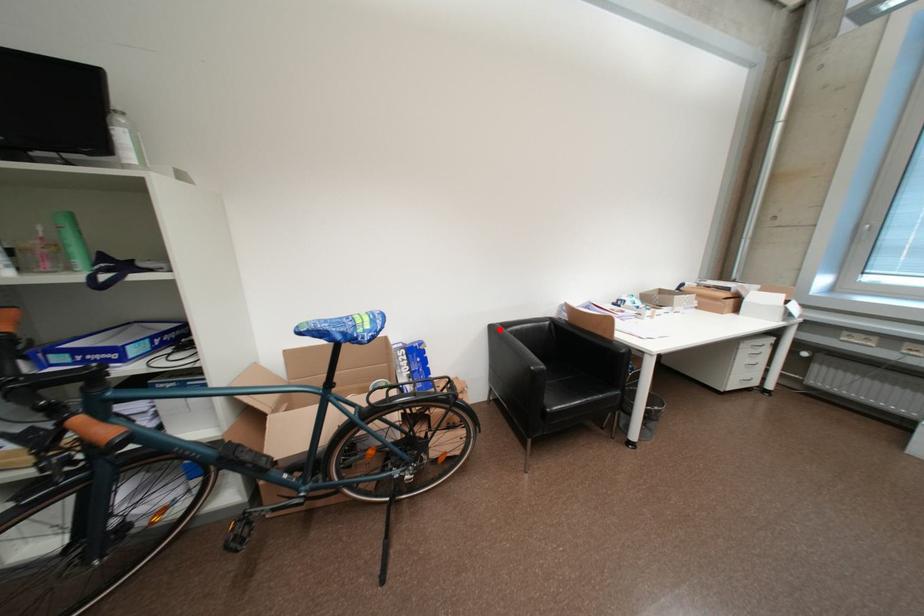
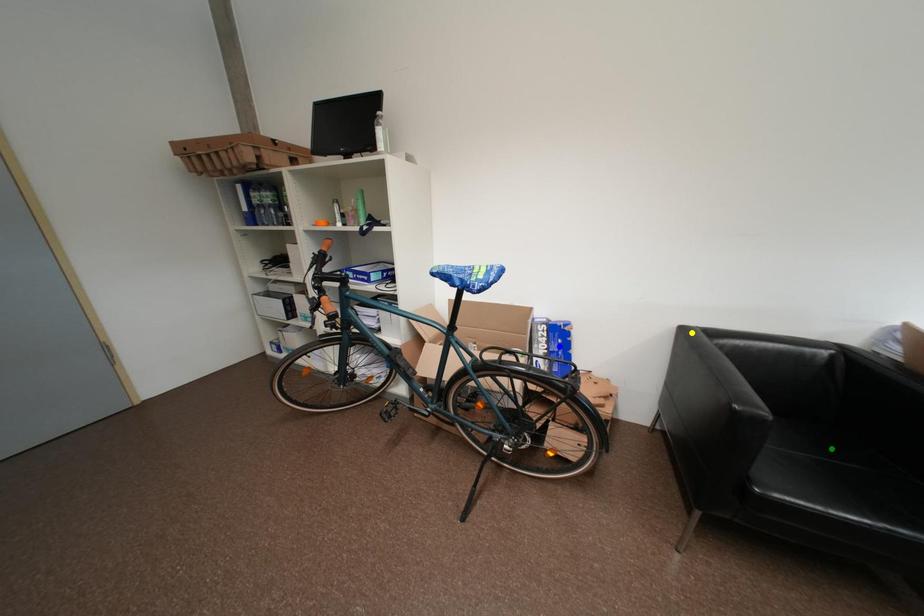
Question: I am providing you with two images of the same scene from different viewpoints. A red point is marked on the first image. You are given multiple points on the second image. Which spot in image 2 lines up with the point in image 1?

Choices:
 (A) green point
 (B) blue point
 (C) yellow point

Answer: (C)